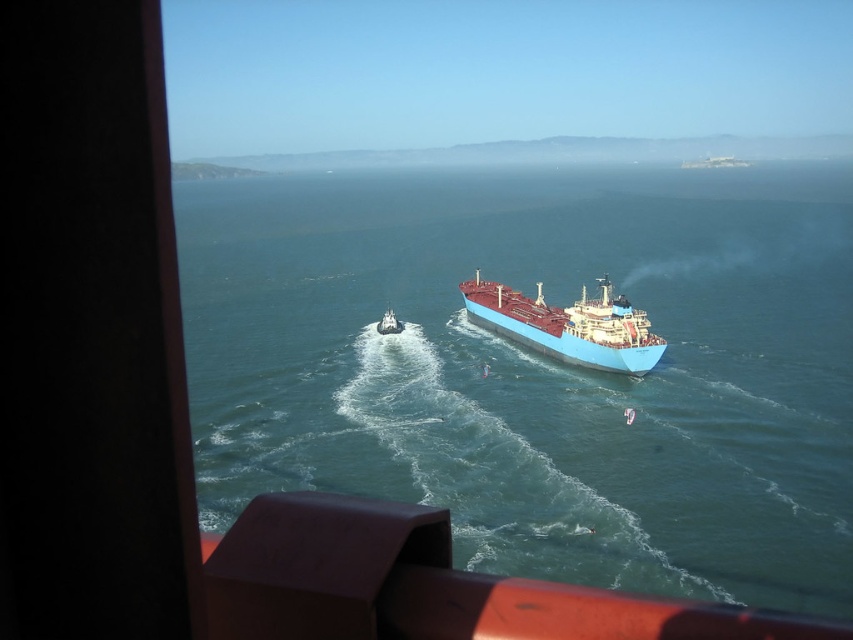
You are on a boat and looking at the blue glossy water at center and the blue matte ship at center. Which one is higher from your viewpoint?

The blue glossy water at center is located above the blue matte ship at center, so it is higher from your viewpoint.